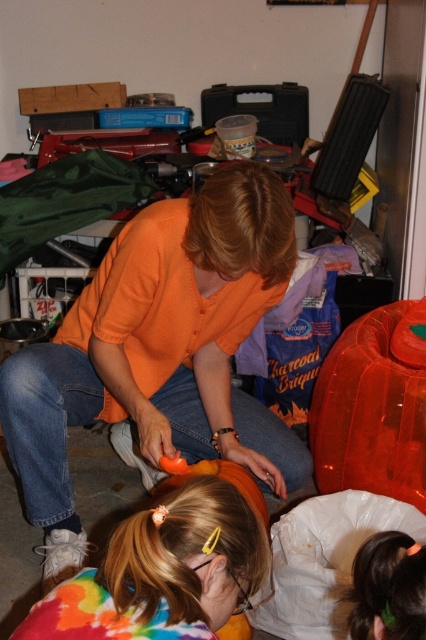
Question: Which point appears closest to the camera in this image?

Choices:
 (A) (365, 579)
 (B) (192, 413)
 (C) (29, 625)

Answer: (C)

Question: Which object is the closest to the multicolored tie-dye shirt at lower center?

Choices:
 (A) orange matte shirt at center
 (B) tie-dye fabric at lower left

Answer: (B)

Question: Which point is closer to the camera?

Choices:
 (A) orange matte shirt at center
 (B) tie-dye fabric at lower left
 (C) multicolored tie-dye shirt at lower center

Answer: (B)

Question: Is orange matte shirt at center behind tie-dye fabric at lower left?

Choices:
 (A) yes
 (B) no

Answer: (A)

Question: Can you confirm if orange matte shirt at center is wider than multicolored tie-dye shirt at lower center?

Choices:
 (A) yes
 (B) no

Answer: (A)

Question: Does orange matte shirt at center appear under tie-dye fabric at lower left?

Choices:
 (A) no
 (B) yes

Answer: (A)